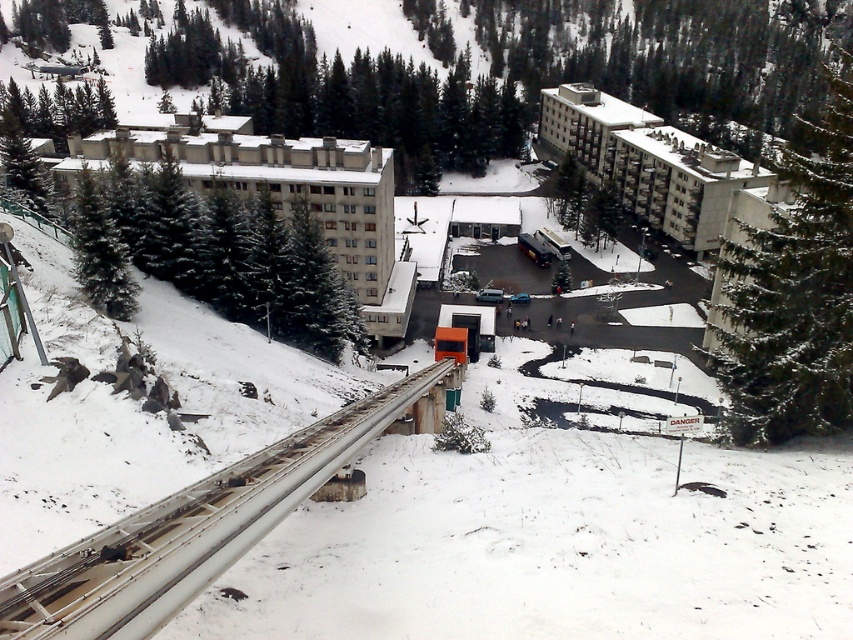
Does green textured pine at right come behind beige concrete building at center-left?

No, it is not.

Who is taller, green textured pine at right or beige concrete building at center-left?

green textured pine at right is taller.

Identify the location of green textured pine at right. This screenshot has width=853, height=640. (793, 288).

Is the position of green textured pine at right more distant than that of white concrete building at center-right?

No, it is not.

Is green textured pine at right wider than white concrete building at center-right?

Yes.

Who is more distant from viewer, [740,256] or [669,131]?

The point [669,131] is behind.

Image resolution: width=853 pixels, height=640 pixels. Identify the location of green textured pine at right. (793, 288).

Is beige concrete building at center-left behind white concrete building at center-right?

No, it is not.

The width and height of the screenshot is (853, 640). In order to click on beige concrete building at center-left in this screenshot , I will do `click(281, 188)`.